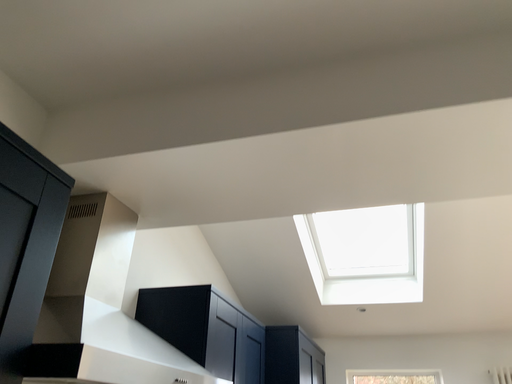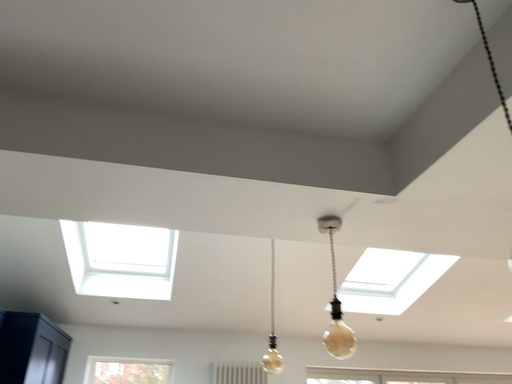
Question: How did the camera likely rotate when shooting the video?

Choices:
 (A) rotated right
 (B) rotated left

Answer: (A)